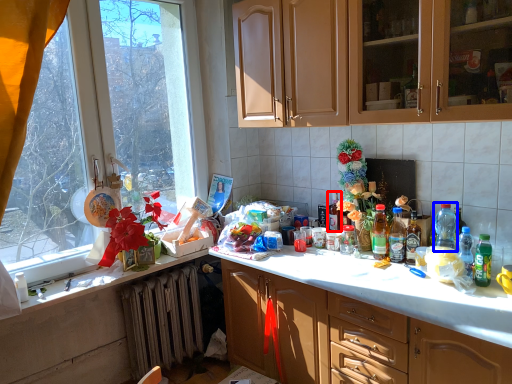
Question: Which of the following is the closest to the observer, bottle (highlighted by a red box) or bottle (highlighted by a blue box)?

Choices:
 (A) bottle
 (B) bottle

Answer: (B)